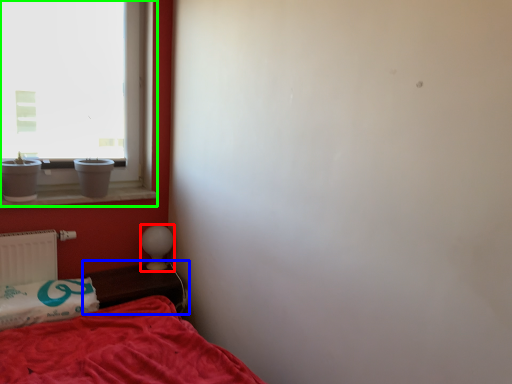
Question: Which object is the closest to the table lamp (highlighted by a red box)? Choose among these: table (highlighted by a blue box) or window (highlighted by a green box).

Choices:
 (A) table
 (B) window

Answer: (A)